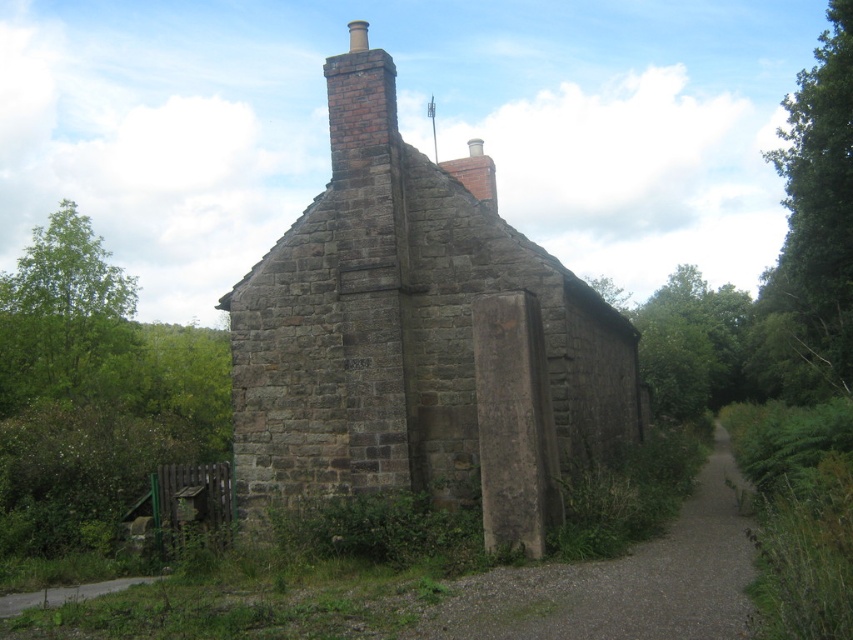
You are standing on the dirt path in front of the rustic stone building. You notice two green leafy trees in the scene. Which tree, the green leafy tree at upper right or the green leafy tree at left, is positioned higher up in the image?

The green leafy tree at upper right is positioned higher up in the image compared to the green leafy tree at left.

You are a delivery person trying to determine the best route to deliver a package to the brown stone cottage at center. You notice the brown brick chimney at upper center. Which structure is taller?

The brown brick chimney at upper center is taller than the brown stone cottage at center.

You are a hiker standing at the entrance of the rustic stone building and want to take a photo of both the green leafy tree at upper right and the green leafy tree at left. Which tree should you position yourself closer to in order to capture both in the same frame?

You should position yourself closer to the green leafy tree at upper right because it is thinner than the green leafy tree at left, allowing both to fit within the frame more easily when you are nearer to the smaller one.